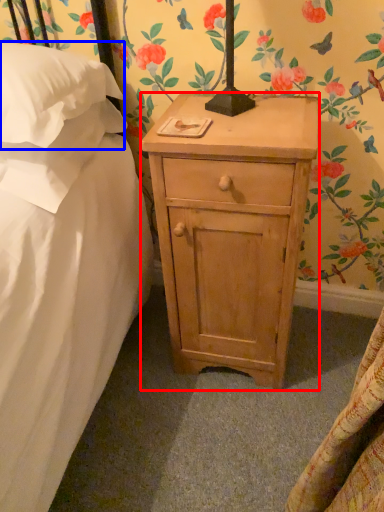
Question: Among these objects, which one is farthest to the camera, nightstand (highlighted by a red box) or pillow (highlighted by a blue box)?

Choices:
 (A) nightstand
 (B) pillow

Answer: (A)